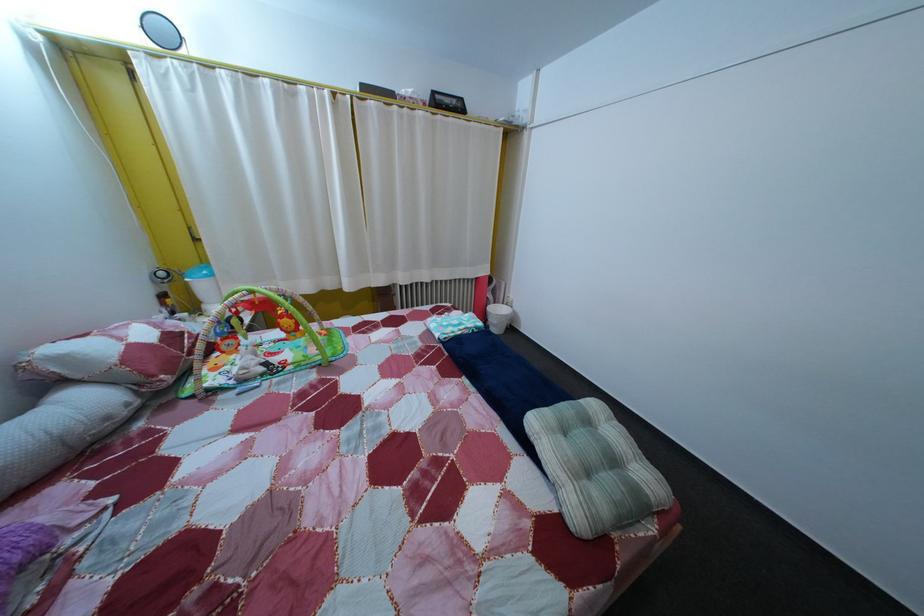
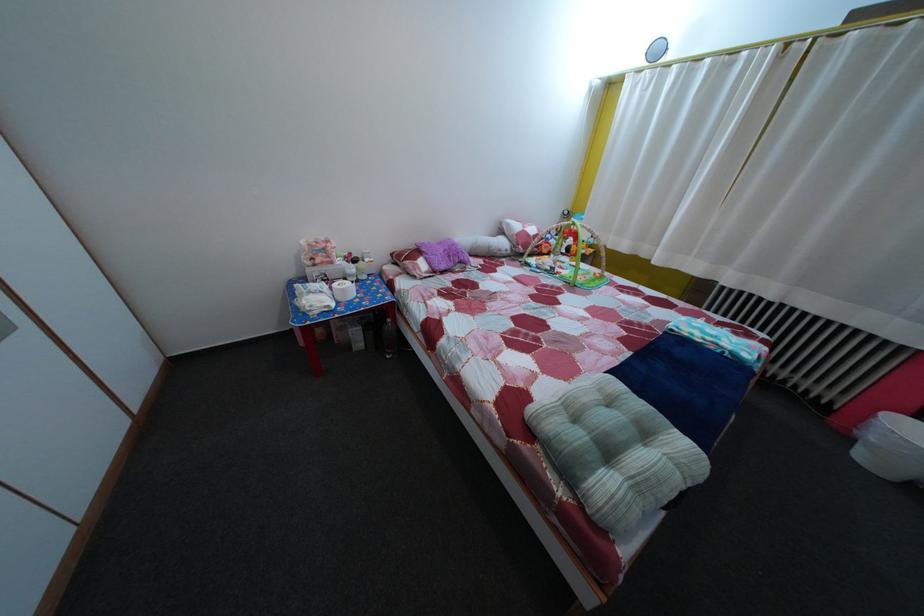
The point at (497, 336) is marked in the first image. Where is the corresponding point in the second image?

(860, 447)